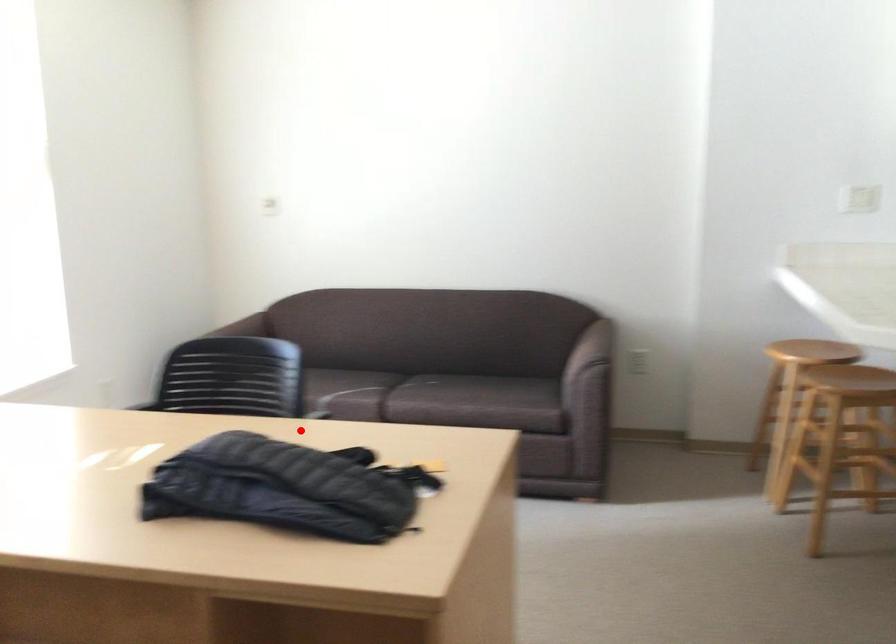
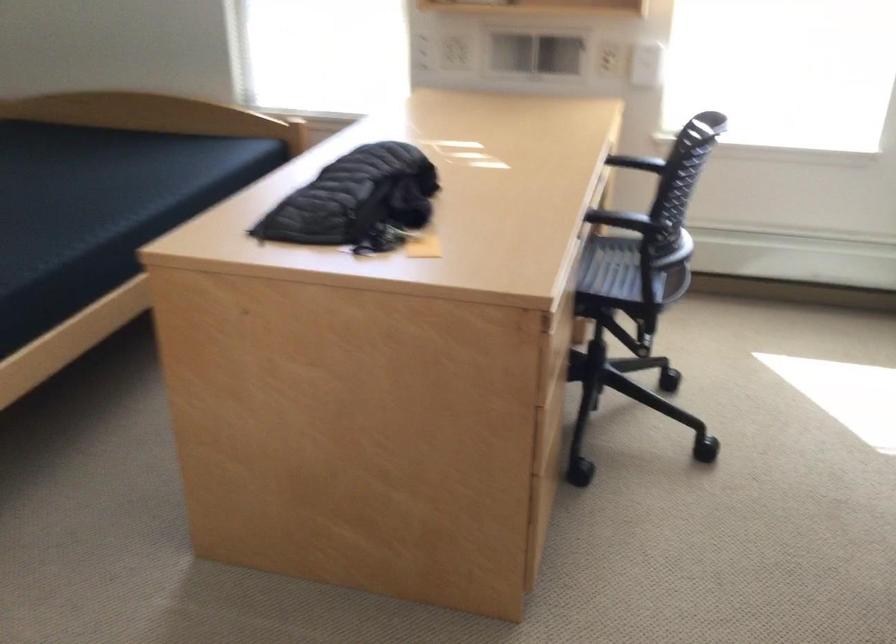
Where in the second image is the point corresponding to the highlighted location from the first image?

(597, 216)